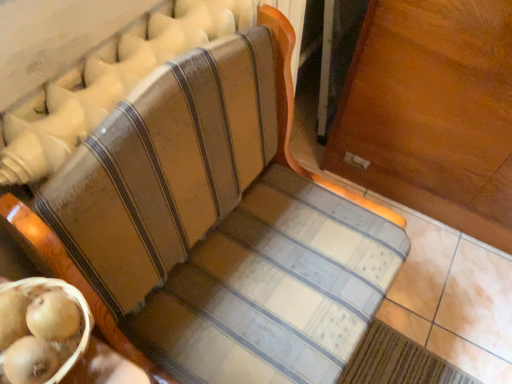
Question: Do you think smooth golden kiwi at lower left is within wooden textured basket at lower left, or outside of it?

Choices:
 (A) outside
 (B) inside

Answer: (B)

Question: In terms of height, does smooth golden kiwi at lower left look taller or shorter compared to wooden textured basket at lower left?

Choices:
 (A) short
 (B) tall

Answer: (A)

Question: Would you say smooth golden kiwi at lower left is to the left or to the right of wooden textured basket at lower left in the picture?

Choices:
 (A) right
 (B) left

Answer: (A)

Question: From the image's perspective, relative to smooth golden kiwi at lower left, is wooden textured basket at lower left above or below?

Choices:
 (A) below
 (B) above

Answer: (A)

Question: Is point (60, 281) positioned closer to the camera than point (70, 332)?

Choices:
 (A) closer
 (B) farther

Answer: (B)

Question: Relative to smooth golden kiwi at lower left, is wooden textured basket at lower left in front or behind?

Choices:
 (A) behind
 (B) front

Answer: (B)

Question: From a real-world perspective, is wooden textured basket at lower left physically located above or below smooth golden kiwi at lower left?

Choices:
 (A) below
 (B) above

Answer: (A)